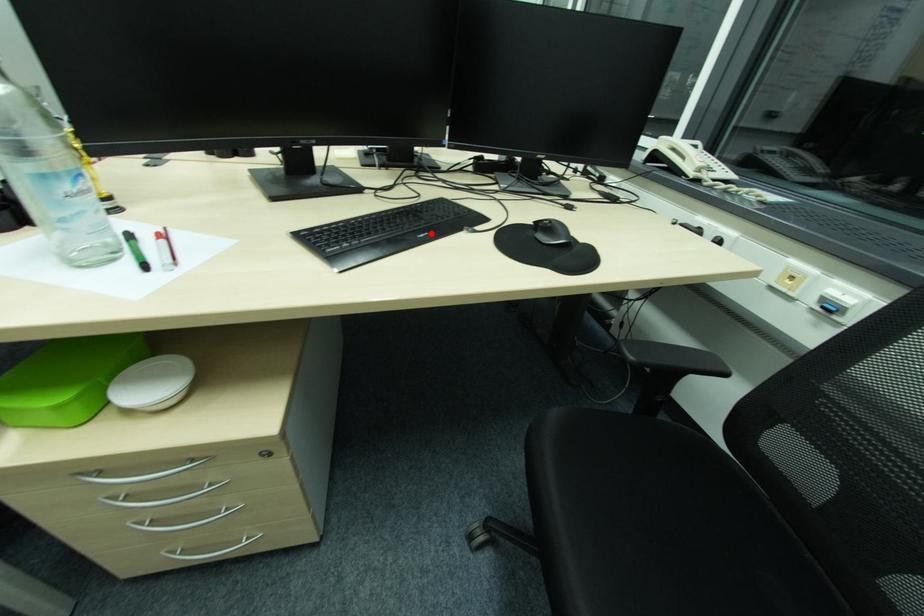
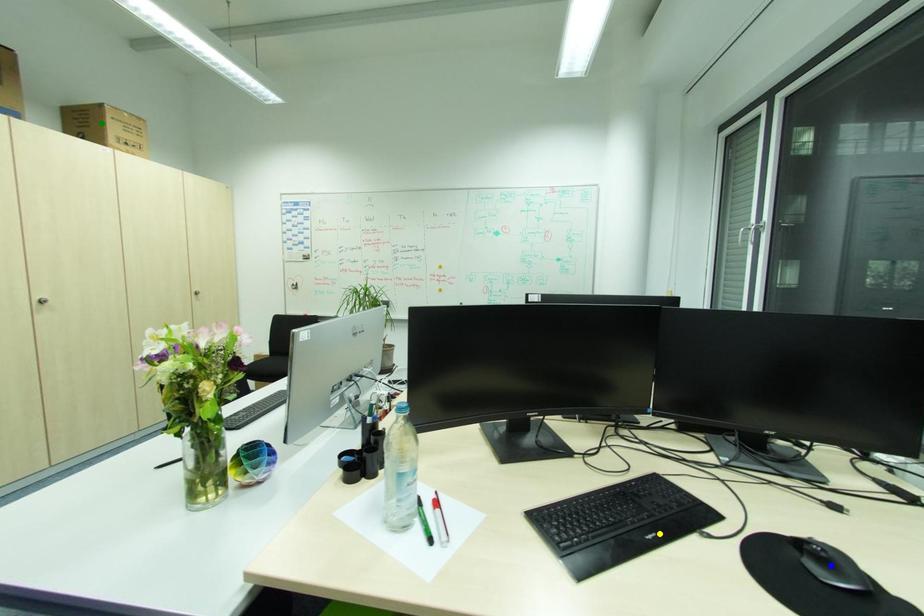
Question: I am providing you with two images of the same scene from different viewpoints. A red point is marked on the first image. You are given multiple points on the second image. Can you choose the point in image 2 that corresponds to the point in image 1?

Choices:
 (A) yellow point
 (B) blue point
 (C) green point

Answer: (A)